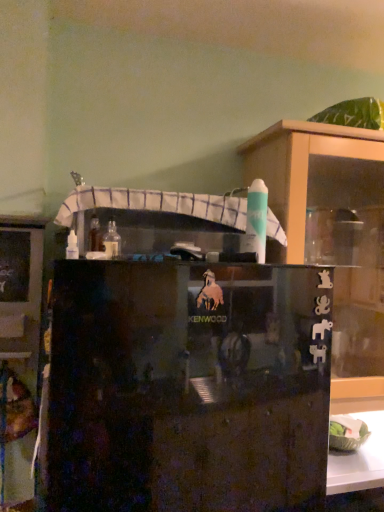
Question: From a real-world perspective, is transparent glass cupboard at upper right over black glossy cabinet at center, which is the 2th cabinetry from left to right?

Choices:
 (A) yes
 (B) no

Answer: (A)

Question: From the image's perspective, is transparent glass cupboard at upper right located beneath black glossy cabinet at center, the 1th cabinetry positioned from the right?

Choices:
 (A) no
 (B) yes

Answer: (A)

Question: Is the depth of transparent glass cupboard at upper right less than that of black glossy cabinet at center, which is the 2th cabinetry from left to right?

Choices:
 (A) yes
 (B) no

Answer: (B)

Question: Is transparent glass cupboard at upper right facing away from black glossy cabinet at center, which is the 2th cabinetry from left to right?

Choices:
 (A) yes
 (B) no

Answer: (B)

Question: Is transparent glass cupboard at upper right not within black glossy cabinet at center, the 1th cabinetry positioned from the right?

Choices:
 (A) yes
 (B) no

Answer: (A)

Question: Is transparent glass cupboard at upper right at the right side of black glossy cabinet at center, which is the 2th cabinetry from left to right?

Choices:
 (A) no
 (B) yes

Answer: (B)

Question: Is matte black cabinet at left, the 1th cabinetry viewed from the left, inside transparent glass cupboard at upper right?

Choices:
 (A) no
 (B) yes

Answer: (A)

Question: Would you say transparent glass cupboard at upper right is outside matte black cabinet at left, the 2th cabinetry when ordered from right to left?

Choices:
 (A) yes
 (B) no

Answer: (A)

Question: Is transparent glass cupboard at upper right positioned in front of matte black cabinet at left, the 2th cabinetry when ordered from right to left?

Choices:
 (A) yes
 (B) no

Answer: (B)

Question: Considering the relative sizes of transparent glass cupboard at upper right and matte black cabinet at left, the 2th cabinetry when ordered from right to left, in the image provided, is transparent glass cupboard at upper right smaller than matte black cabinet at left, the 2th cabinetry when ordered from right to left,?

Choices:
 (A) no
 (B) yes

Answer: (A)

Question: Considering the relative sizes of transparent glass cupboard at upper right and matte black cabinet at left, the 1th cabinetry viewed from the left, in the image provided, is transparent glass cupboard at upper right shorter than matte black cabinet at left, the 1th cabinetry viewed from the left,?

Choices:
 (A) no
 (B) yes

Answer: (A)

Question: From the image's perspective, would you say transparent glass cupboard at upper right is positioned over matte black cabinet at left, the 1th cabinetry viewed from the left?

Choices:
 (A) yes
 (B) no

Answer: (A)

Question: Are transparent glass cupboard at upper right and clear glass bottle at center beside each other?

Choices:
 (A) no
 (B) yes

Answer: (A)